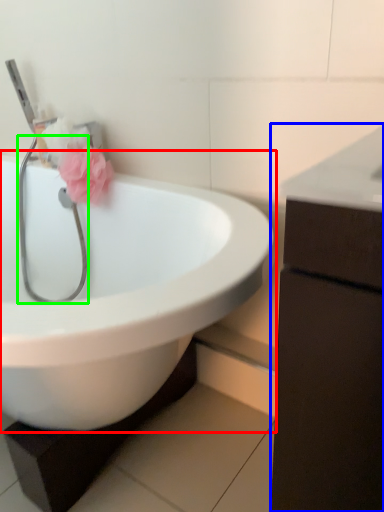
Question: Which object is the closest to the sink (highlighted by a red box)? Choose among these: bathroom cabinet (highlighted by a blue box) or stethoscope (highlighted by a green box).

Choices:
 (A) bathroom cabinet
 (B) stethoscope

Answer: (B)